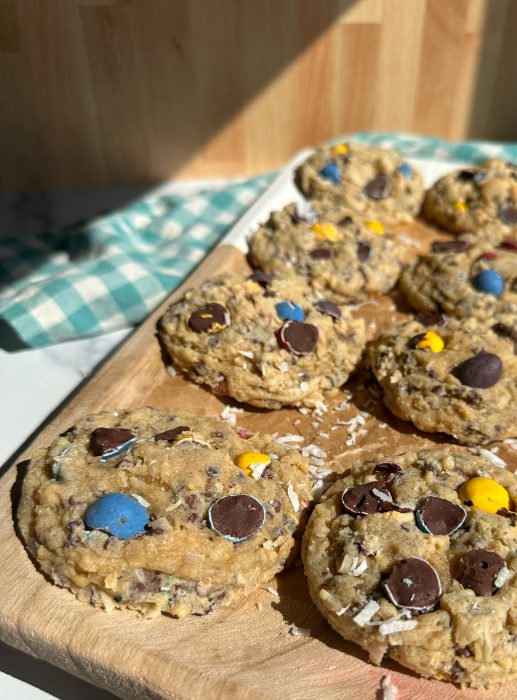
At what (x,y) coordinates should I click in order to perform the action: click on blue and white checkered cloth. Please return your answer as a coordinate pair (x, y). Looking at the image, I should click on pyautogui.click(x=149, y=218).